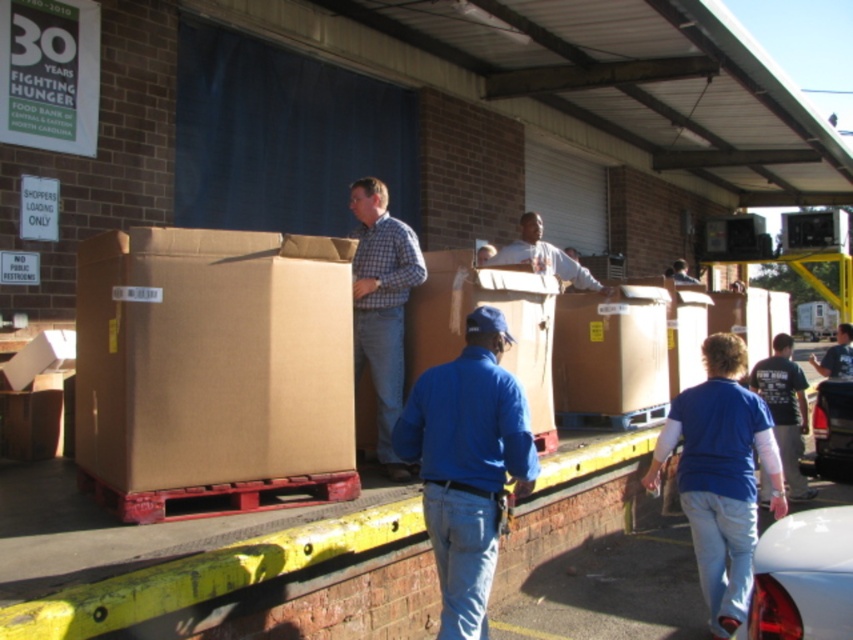
Image resolution: width=853 pixels, height=640 pixels. What do you see at coordinates (802, 577) in the screenshot? I see `shiny white car at lower right` at bounding box center [802, 577].

Where is `shiny white car at lower right`? This screenshot has height=640, width=853. shiny white car at lower right is located at coordinates tap(802, 577).

The width and height of the screenshot is (853, 640). Describe the element at coordinates (802, 577) in the screenshot. I see `shiny white car at lower right` at that location.

Locate an element on the screen. shiny white car at lower right is located at coordinates (802, 577).

Which is more to the left, shiny black car at lower right or white matte shirt at center?

From the viewer's perspective, white matte shirt at center appears more on the left side.

Who is more forward, [833,419] or [567,266]?

Point [567,266]

Find the location of a particular element. shiny black car at lower right is located at coordinates (833, 429).

Who is lower down, shiny white car at lower right or dark blue shirt at center?

dark blue shirt at center is below.

Where is `shiny white car at lower right`? The width and height of the screenshot is (853, 640). shiny white car at lower right is located at coordinates (802, 577).